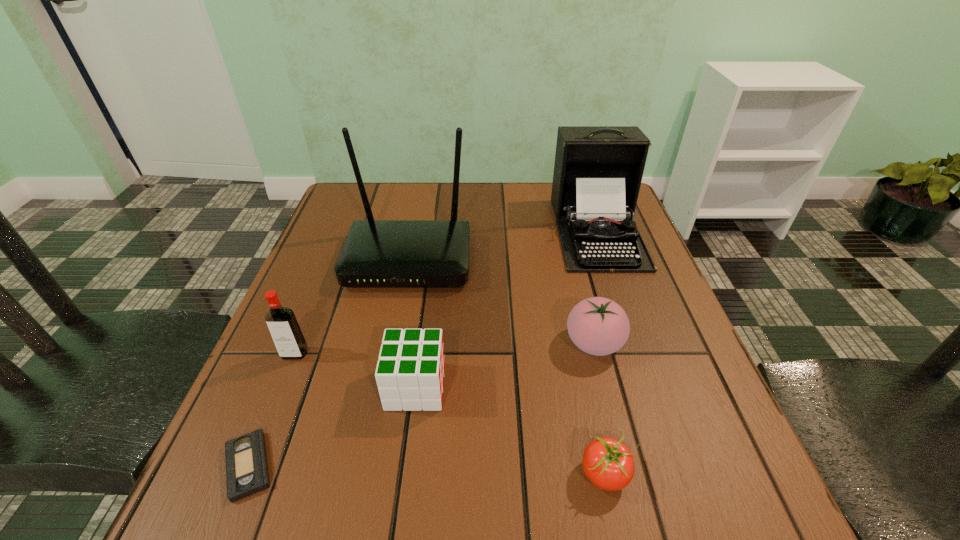
Find the location of a particular element. free space between the nearer tomato and the router is located at coordinates (507, 367).

In order to click on free space that is in between the farther tomato and the cube in this screenshot , I will do `click(505, 365)`.

Where is `empty space between the videotape and the nearer tomato`? This screenshot has height=540, width=960. empty space between the videotape and the nearer tomato is located at coordinates pos(427,470).

At what (x,y) coordinates should I click in order to perform the action: click on vacant space in between the shortest object and the router. Please return your answer as a coordinate pair (x, y). The width and height of the screenshot is (960, 540). Looking at the image, I should click on (329, 363).

Identify which object is located as the fifth nearest to the fifth shortest object. Please provide its 2D coordinates. Your answer should be formatted as a tuple, i.e. [(x, y)], where the tuple contains the x and y coordinates of a point satisfying the conditions above.

[(608, 463)]

Find the location of `object identified as the fifth closest to the cube`. object identified as the fifth closest to the cube is located at coordinates (598, 326).

The width and height of the screenshot is (960, 540). I want to click on vacant space that satisfies the following two spatial constraints: 1. on the red face of the cube; 2. on the right side of the nearer tomato, so click(x=404, y=474).

Locate an element on the screen. The height and width of the screenshot is (540, 960). blank space that satisfies the following two spatial constraints: 1. on the red face of the cube; 2. on the front side of the shortest object is located at coordinates (405, 466).

At what (x,y) coordinates should I click in order to perform the action: click on vacant space that satisfies the following two spatial constraints: 1. on the front and back of the vodka; 2. on the left side of the shorter tomato. Please return your answer as a coordinate pair (x, y). Looking at the image, I should click on (247, 474).